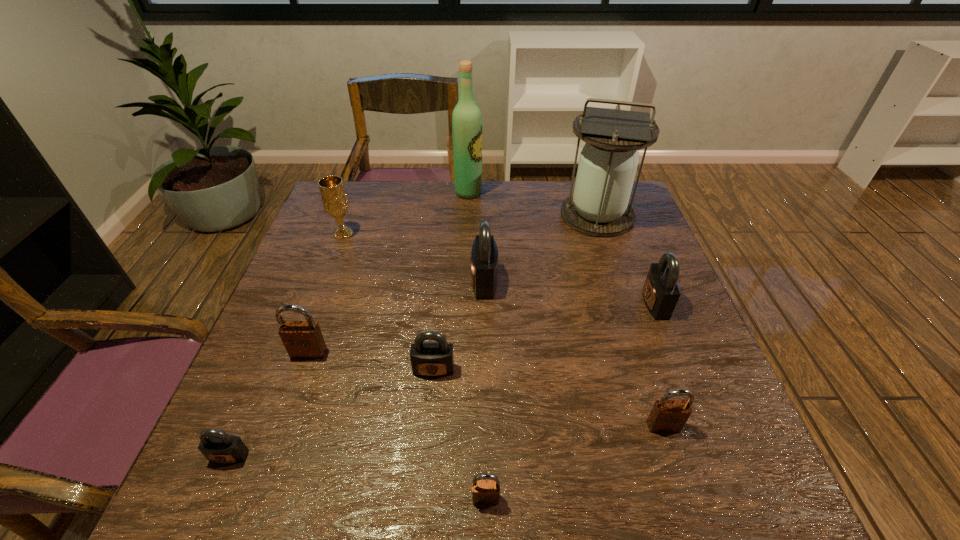
You are a GUI agent. You are given a task and a screenshot of the screen. Output one action in this format:
    pyautogui.click(x=<x>, y=<y>)
    Task: Click on the wine bottle that is at the far edge
    This screenshot has height=540, width=960.
    Given the screenshot: What is the action you would take?
    pyautogui.click(x=466, y=118)

This screenshot has width=960, height=540. What are the coordinates of `lantern located at the far edge` in the screenshot? It's located at (599, 206).

Where is `chalice at the left edge`? This screenshot has height=540, width=960. chalice at the left edge is located at coordinates (334, 198).

The width and height of the screenshot is (960, 540). I want to click on lantern positioned at the right edge, so click(x=599, y=206).

Where is `object located in the near left corner section of the desktop`? Image resolution: width=960 pixels, height=540 pixels. object located in the near left corner section of the desktop is located at coordinates (217, 446).

Locate an element on the screen. object present at the far right corner is located at coordinates (599, 206).

You are a GUI agent. You are given a task and a screenshot of the screen. Output one action in this format:
    pyautogui.click(x=<x>, y=<y>)
    Task: Click on the vacant region at the far edge of the desktop
    
    Given the screenshot: What is the action you would take?
    pyautogui.click(x=399, y=200)

At what (x,y) coordinates should I click in order to perform the action: click on free space at the left edge of the desktop. Please return your answer as a coordinate pair (x, y). This screenshot has height=540, width=960. Looking at the image, I should click on (278, 434).

Where is `vacant space at the right edge`? vacant space at the right edge is located at coordinates (667, 390).

Locate an element on the screen. vacant region at the far left corner of the desktop is located at coordinates (364, 211).